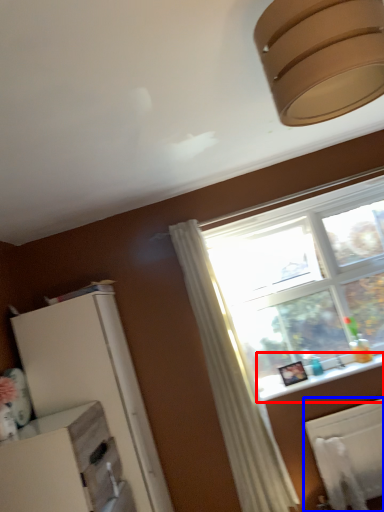
Question: Which point is further to the camera, window sill (highlighted by a red box) or radiator (highlighted by a blue box)?

Choices:
 (A) window sill
 (B) radiator

Answer: (A)